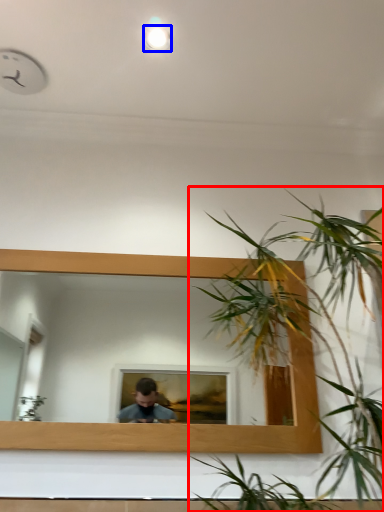
Question: Which object is closer to the camera taking this photo, houseplant (highlighted by a red box) or light (highlighted by a blue box)?

Choices:
 (A) houseplant
 (B) light

Answer: (A)